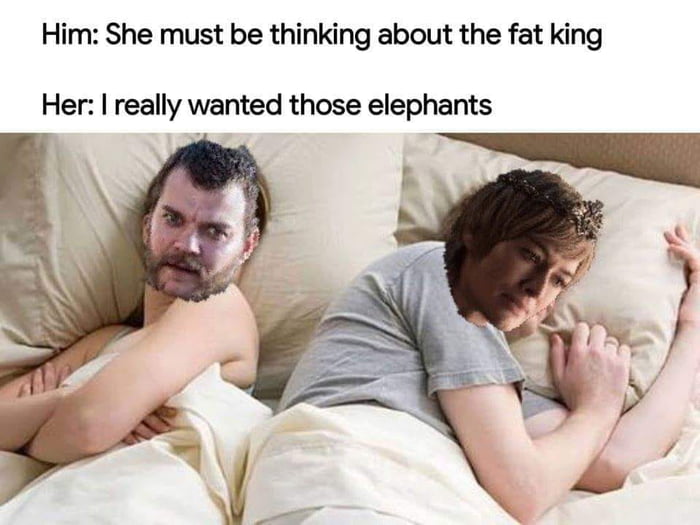
Locate an element on the screen. The width and height of the screenshot is (700, 525). sheet is located at coordinates click(x=322, y=451).